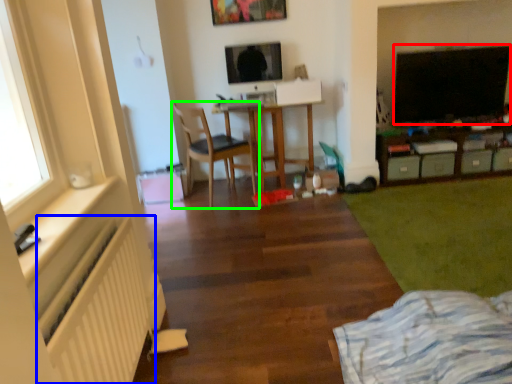
Question: Based on their relative distances, which object is nearer to dark (highlighted by a red box)? Choose from radiator (highlighted by a blue box) and chair (highlighted by a green box).

Choices:
 (A) radiator
 (B) chair

Answer: (B)